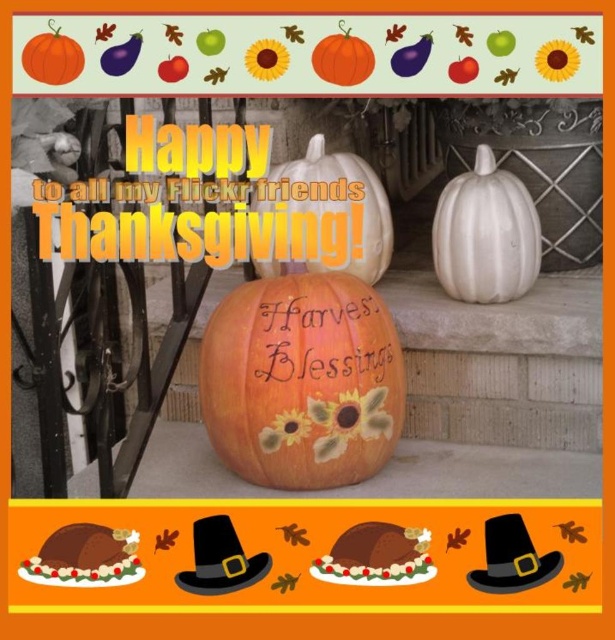
You are designing a Thanksgiving display and want to place a decorative banner above two pumpkins. The banner is 30 cm wide. The orange matte pumpkin at center and the white ceramic pumpkin at center are on the same step. Can the banner fit horizontally between them?

The orange matte pumpkin at center is wider than the white ceramic pumpkin at center. Since the banner is 30 cm wide, it depends on the combined width of the two pumpkins. If their total width is less than 30 cm, the banner can fit. However, without specific measurements, we cannot confirm. Please check the actual sizes.

You are standing in front of a Thanksgiving greeting card. You see a white ceramic pumpkin at center. If you want to take a photo of it with your camera, which is 1.82 meters away, will you need to adjust the focus to a near or far setting? Please explain your reasoning based on the distance provided.

The white ceramic pumpkin at center is 1.82 meters away from the camera. Since 1.82 meters is a moderate distance, you would need to adjust the focus to the far setting to ensure the pumpkin is in clear focus.

Where is the white ceramic pumpkin at center located in the image?

The white ceramic pumpkin at center is located at point 0.367 on the horizontal axis and 0.790 on the vertical axis.